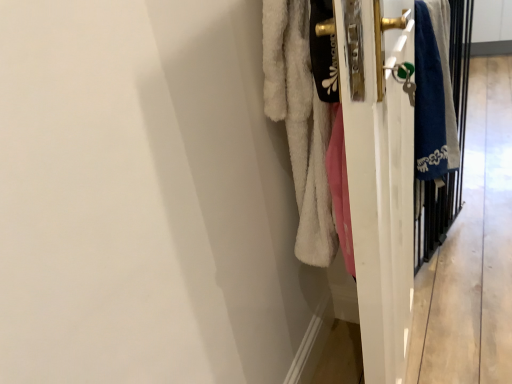
Question: Is the depth of blue towel at right less than that of white fluffy towel at right?

Choices:
 (A) no
 (B) yes

Answer: (A)

Question: Is the depth of blue towel at right greater than that of white fluffy towel at right?

Choices:
 (A) no
 (B) yes

Answer: (B)

Question: From the image's perspective, is blue towel at right over white fluffy towel at right?

Choices:
 (A) yes
 (B) no

Answer: (A)

Question: Is blue towel at right shorter than white fluffy towel at right?

Choices:
 (A) no
 (B) yes

Answer: (B)

Question: Does blue towel at right have a greater width compared to white fluffy towel at right?

Choices:
 (A) no
 (B) yes

Answer: (A)

Question: Considering the relative positions of blue towel at right and white fluffy towel at right in the image provided, is blue towel at right to the left of white fluffy towel at right from the viewer's perspective?

Choices:
 (A) yes
 (B) no

Answer: (B)

Question: Can you confirm if white fluffy towel at right is smaller than blue fabric screen door at right?

Choices:
 (A) yes
 (B) no

Answer: (B)

Question: Is white fluffy towel at right turned away from blue fabric screen door at right?

Choices:
 (A) yes
 (B) no

Answer: (B)

Question: Is the surface of white fluffy towel at right in direct contact with blue fabric screen door at right?

Choices:
 (A) no
 (B) yes

Answer: (A)

Question: Does white fluffy towel at right have a lesser height compared to blue fabric screen door at right?

Choices:
 (A) no
 (B) yes

Answer: (A)

Question: From a real-world perspective, is white fluffy towel at right beneath blue fabric screen door at right?

Choices:
 (A) yes
 (B) no

Answer: (A)

Question: Does white fluffy towel at right come in front of blue fabric screen door at right?

Choices:
 (A) yes
 (B) no

Answer: (A)

Question: Is blue fabric screen door at right located outside white fluffy towel at right?

Choices:
 (A) no
 (B) yes

Answer: (B)